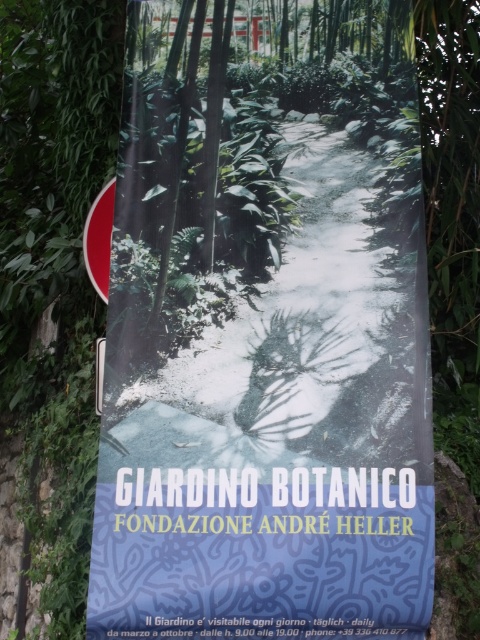
Question: Which point appears closest to the camera in this image?

Choices:
 (A) (100, 228)
 (B) (322, 500)

Answer: (B)

Question: Is matte black signboard at center bigger than matte red sign at upper left?

Choices:
 (A) no
 (B) yes

Answer: (B)

Question: Does matte black signboard at center lie in front of matte red sign at upper left?

Choices:
 (A) yes
 (B) no

Answer: (A)

Question: Does matte black signboard at center come behind matte red sign at upper left?

Choices:
 (A) yes
 (B) no

Answer: (B)